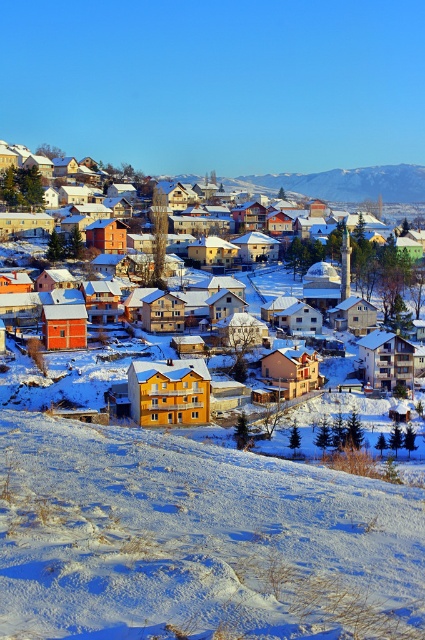
You are standing in the winter scene and want to walk from point A to point B. Point A is located at coordinate point(377,170) and point B is at coordinate point(401,177). Since both points are on the snow, which point is closer to you?

Point A at coordinate point(377,170) is closer to you because it is further to the viewer than point B at coordinate point(401,177).

You are standing at the center of the snowy landscape and want to place a small red flag exactly at the white powdery snow at lower left. What are the coordinates where you should place the flag?

The coordinates for the white powdery snow at lower left are 0.845 on the x axis and 0.464 on the y axis.

You are an architect designing a new ski resort. You need to decide where to place the main lodge. The lodge must be built on the white powdery snow at lower left and the snowy mountain range at upper center. Which location has more space for constructing the lodge?

The snowy mountain range at upper center has more space because it is larger than the white powdery snow at lower left.